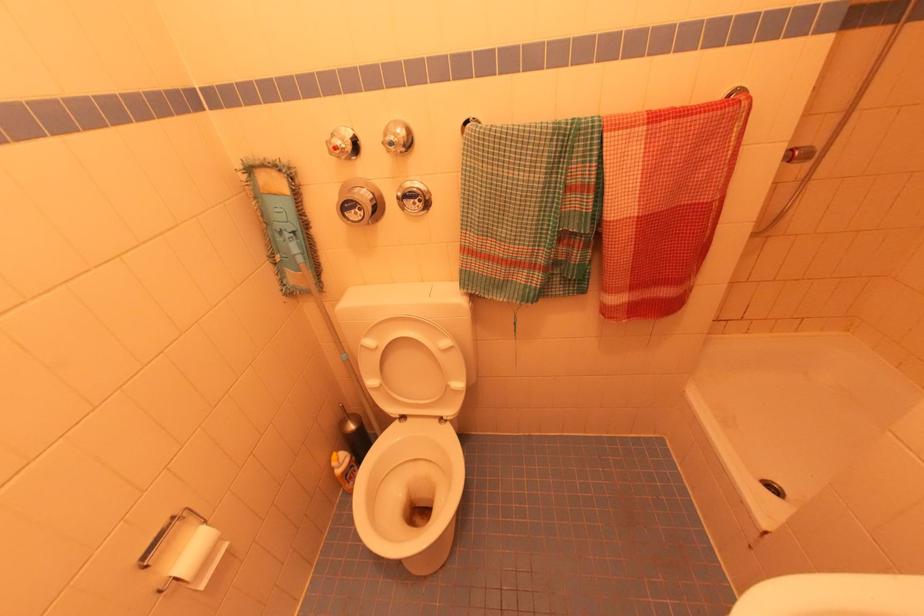
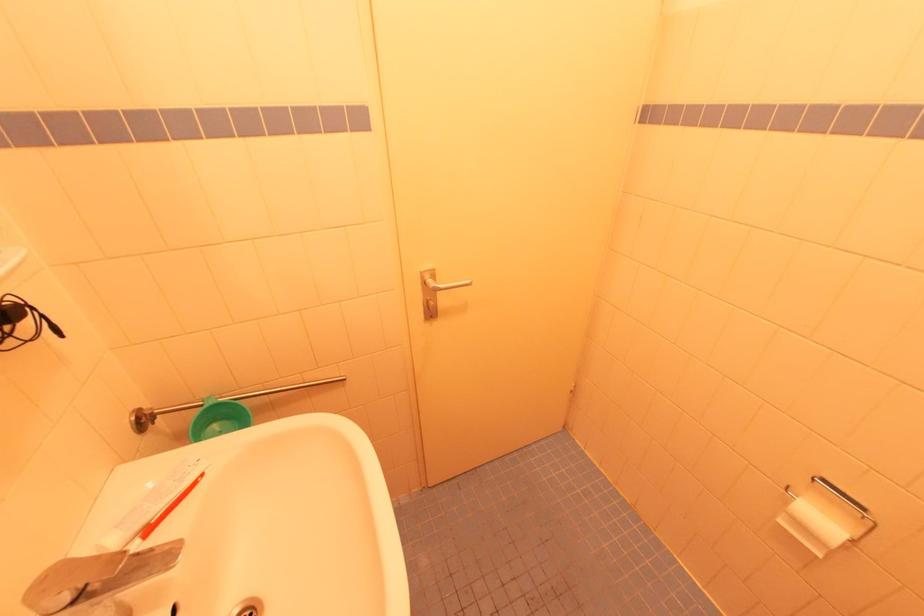
In the second image, find the point that corresponds to (x=204, y=586) in the first image.

(784, 523)